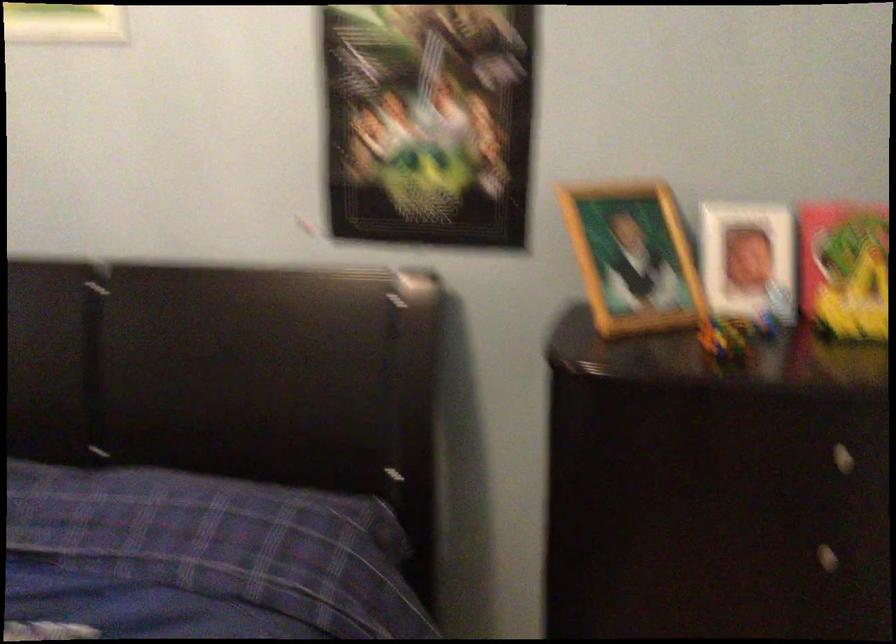
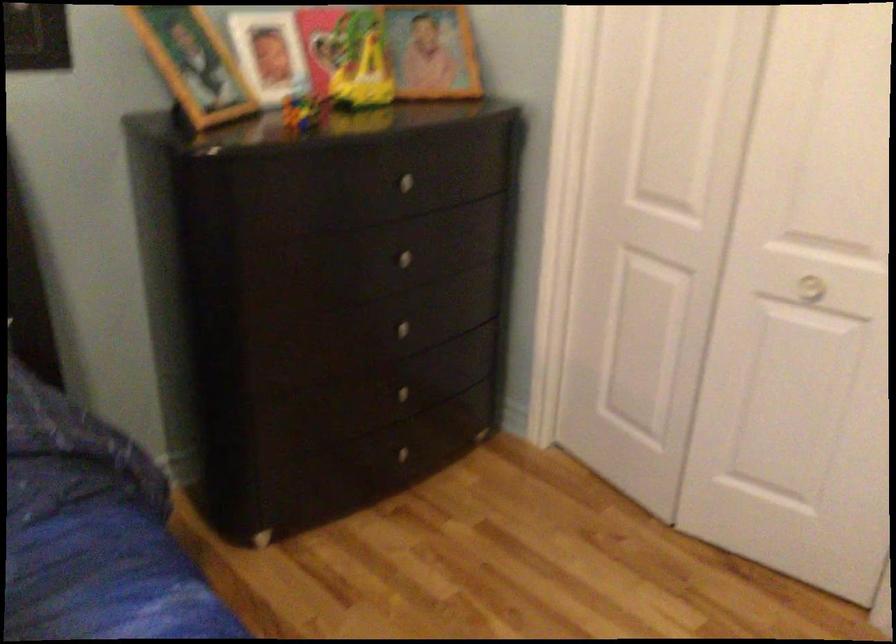
The point at (719,333) is marked in the first image. Where is the corresponding point in the second image?

(303, 111)